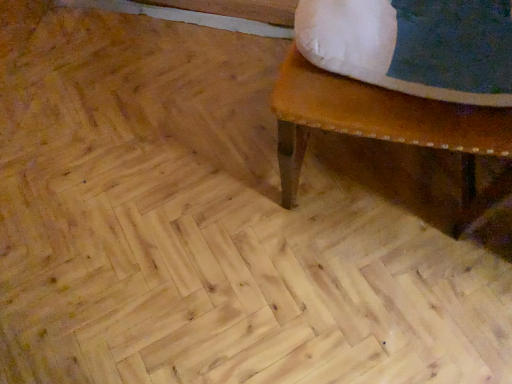
You are a GUI agent. You are given a task and a screenshot of the screen. Output one action in this format:
    pyautogui.click(x=<x>, y=<y>)
    Task: Click on the vacant point to the left of brown wooden bench at upper right
    The image size is (512, 384).
    Given the screenshot: What is the action you would take?
    pyautogui.click(x=205, y=174)